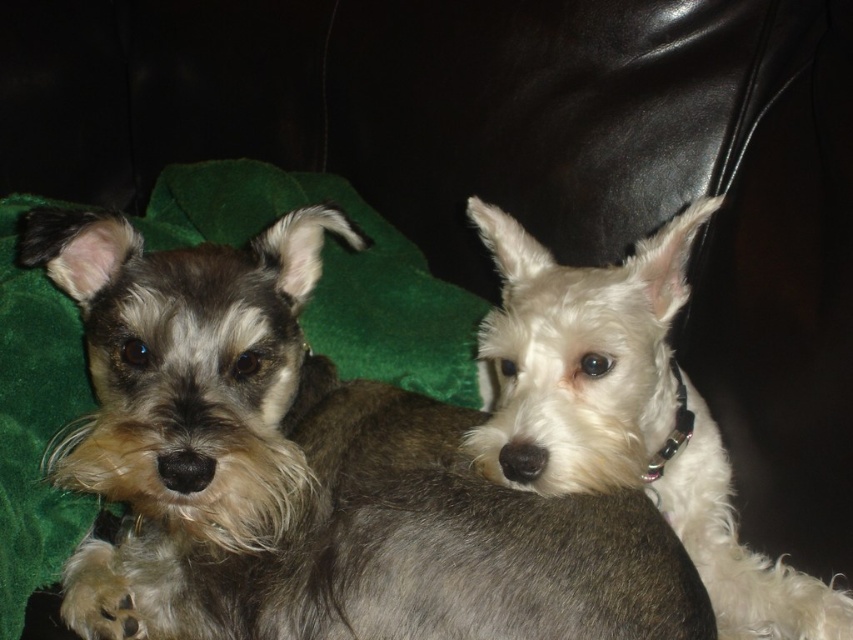
You are a dog sitter and need to place both the gray fur dog at center and the white fur dog at upper right into a single dog carrier. The carrier can only accommodate one dog at a time. Which dog should you prioritize placing first to ensure the carrier can fit both?

The gray fur dog at center is bigger than the white fur dog at upper right, so you should prioritize placing the gray fur dog at center first to ensure the carrier can fit both.

You are standing in front of the couch where the two dogs are resting. There is a point marked at coordinates (x=310, y=472). Which dog is this point located on?

The point at (x=310, y=472) is located on the gray fur dog at center.

You are a photographer standing at a certain distance from the gray fur dog at center. You want to take a closeup shot of the dog without moving the camera. Is the current distance sufficient to capture the dog clearly in the photo?

The distance between the gray fur dog at center and the camera is 81.13 centimeters. Whether this is sufficient for a clear closeup depends on the camera lens capabilities, but the provided information does not specify lens details. Thus, based solely on distance, it is possible if the camera can focus at that range.